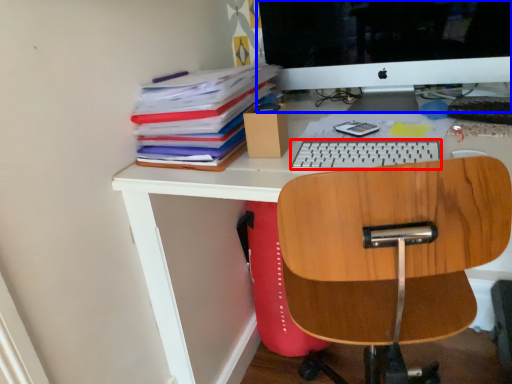
Question: Which object is closer to the camera taking this photo, keyboard (highlighted by a red box) or computer monitor (highlighted by a blue box)?

Choices:
 (A) keyboard
 (B) computer monitor

Answer: (A)